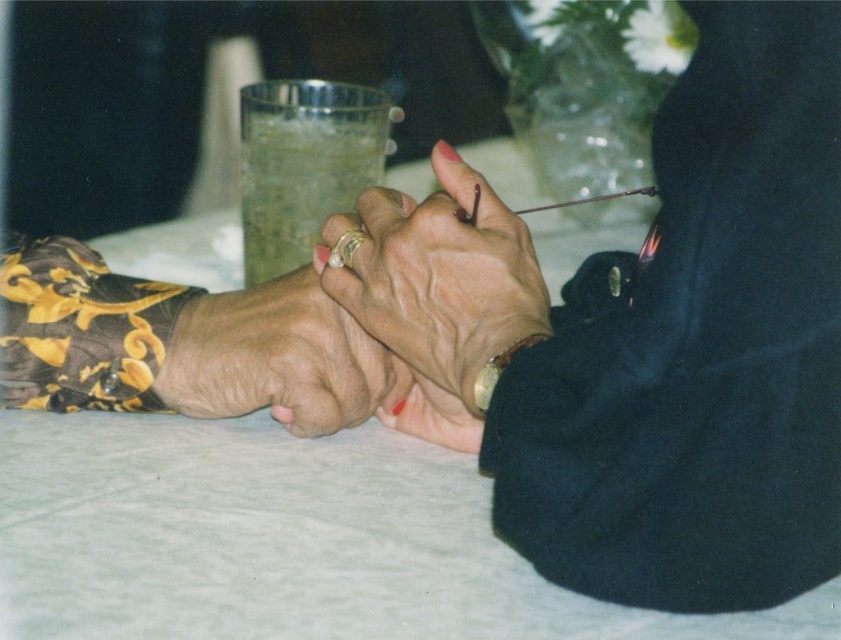
How distant is translucent glass cup at center from gold metallic bracelet at lower right?

They are 8.07 inches apart.

Who is more forward, (291,180) or (504,356)?

Point (504,356) is in front.

Identify the location of translucent glass cup at center. Image resolution: width=841 pixels, height=640 pixels. (302, 177).

Can you confirm if matte gold ring at center is positioned to the left of dry skin hand at center?

In fact, matte gold ring at center is to the right of dry skin hand at center.

Who is taller, matte gold ring at center or dry skin hand at center?

matte gold ring at center

This screenshot has width=841, height=640. What do you see at coordinates (438, 278) in the screenshot?
I see `matte gold ring at center` at bounding box center [438, 278].

Image resolution: width=841 pixels, height=640 pixels. I want to click on matte gold ring at center, so click(438, 278).

Is point (447, 392) behind point (490, 392)?

Yes, point (447, 392) is behind point (490, 392).

Image resolution: width=841 pixels, height=640 pixels. Identify the location of matte gold ring at center. (438, 278).